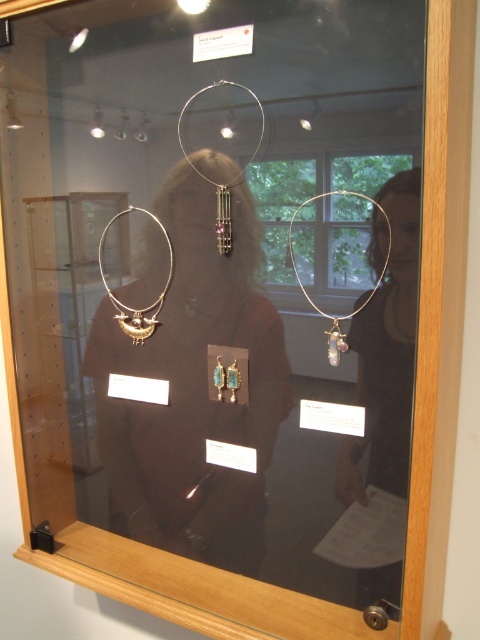
You are a security guard standing 40 inches away from the display case. You notice the matte gold hoop at right inside the case. Can you reach it without moving closer?

The matte gold hoop at right is 36.40 inches away from the camera. Since you are standing 40 inches away from the display case, the distance between you and the matte gold hoop at right would be 40 inches plus the thickness of the case. Therefore, you cannot reach it without moving closer.